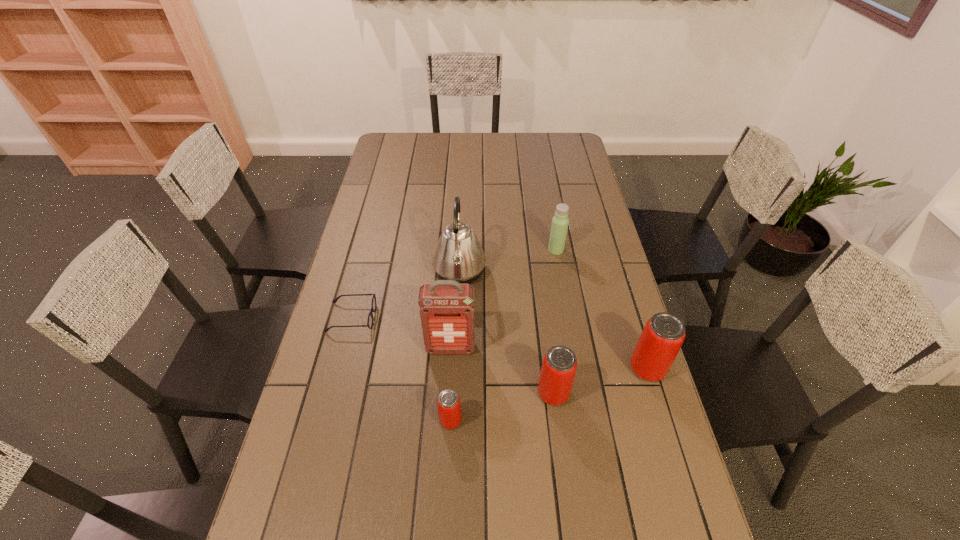
Locate an element on the screen. This screenshot has width=960, height=540. vacant space located on the right of the sixth tallest object is located at coordinates (593, 420).

Identify the location of vacant region located 0.310m on the back of the second beer can from left to right. The image size is (960, 540). (540, 293).

Find the location of `vacant area situated on the left of the rightmost object`. vacant area situated on the left of the rightmost object is located at coordinates (571, 369).

The width and height of the screenshot is (960, 540). What are the coordinates of `vacant area located 0.090m on the left of the second object from right to left` in the screenshot? It's located at (522, 249).

You are a GUI agent. You are given a task and a screenshot of the screen. Output one action in this format:
    pyautogui.click(x=<x>, y=<y>)
    Task: Click on the free point located 0.140m from the spout of the kettle
    
    Given the screenshot: What is the action you would take?
    pyautogui.click(x=528, y=272)

Identify the location of free space located 0.130m on the front-facing side of the spectacles. This screenshot has height=540, width=960. (418, 318).

You are a GUI agent. You are given a task and a screenshot of the screen. Output one action in this format:
    pyautogui.click(x=<x>, y=<y>)
    Task: Click on the free space located 0.050m on the front-facing side of the first-aid kit
    This screenshot has height=540, width=960.
    Given the screenshot: What is the action you would take?
    pyautogui.click(x=449, y=371)

The height and width of the screenshot is (540, 960). Find the location of `object present at the left edge`. object present at the left edge is located at coordinates (373, 305).

In order to click on beer can positioned at the right edge in this screenshot , I will do `click(662, 337)`.

Image resolution: width=960 pixels, height=540 pixels. I want to click on thermos bottle present at the right edge, so click(x=560, y=221).